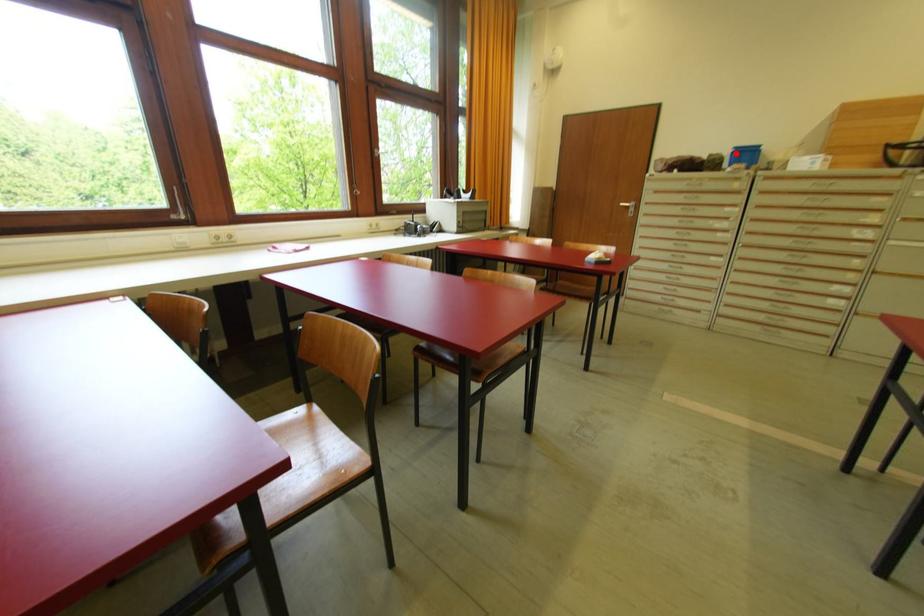
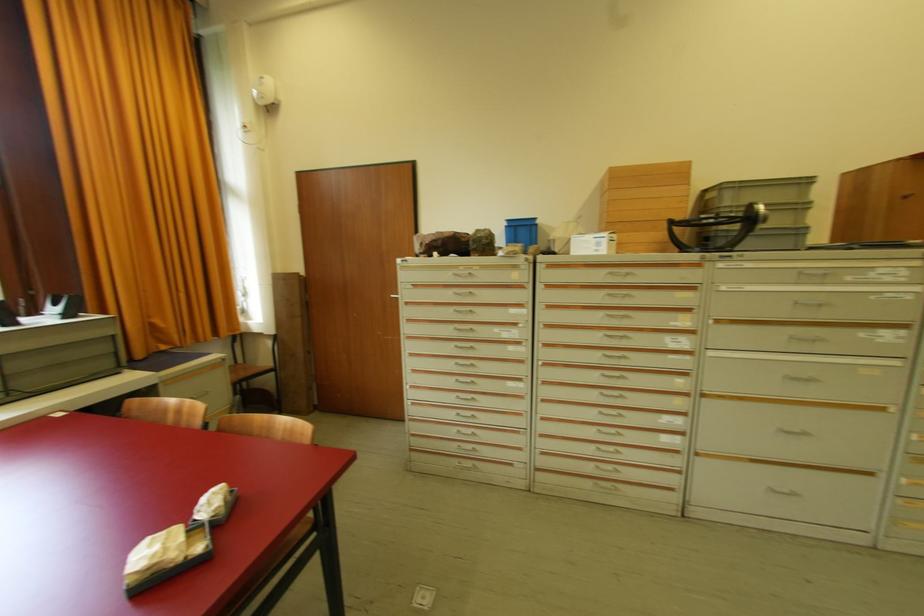
Locate, in the second image, the point that corresponds to the highlighted location in the first image.

(508, 228)